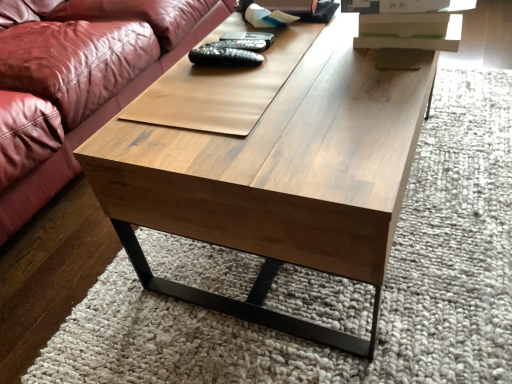
Where is `free spot to the right of black matte remote at center, the 3th remote when ordered from top to bottom`? free spot to the right of black matte remote at center, the 3th remote when ordered from top to bottom is located at coordinates (303, 58).